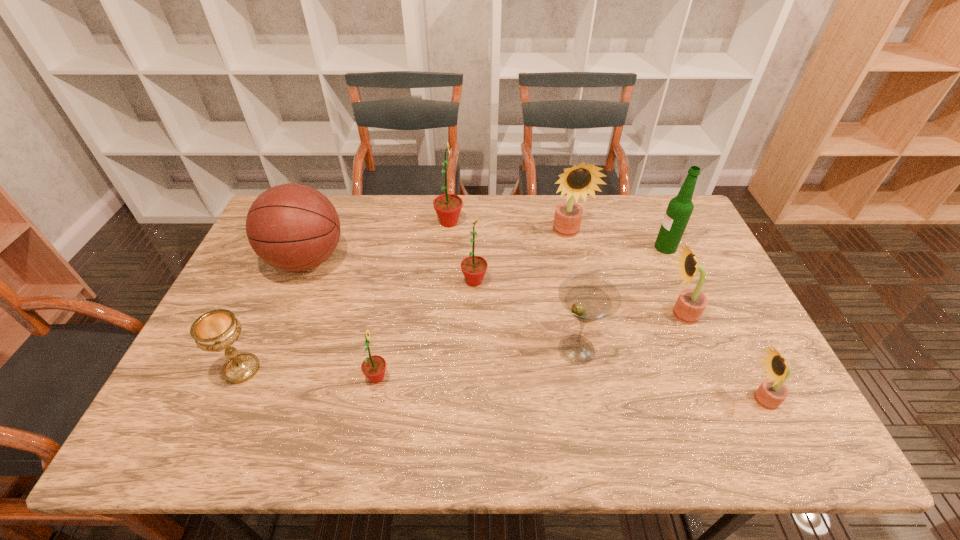
What are the coordinates of `martini` in the screenshot? It's located at (589, 298).

You are a GUI agent. You are given a task and a screenshot of the screen. Output one action in this format:
    pyautogui.click(x=<x>, y=<y>)
    Task: Click on the nearest yellow sunflower
    
    Given the screenshot: What is the action you would take?
    pyautogui.click(x=772, y=392)

Image resolution: width=960 pixels, height=540 pixels. Identify the location of the smallest yellow sunflower. (772, 392).

At what (x,y) coordinates should I click in order to perform the action: click on the leftmost green sunflower. Please return your answer as a coordinate pair (x, y). The image size is (960, 540). Looking at the image, I should click on (373, 367).

Where is `the nearest green sunflower`? This screenshot has height=540, width=960. the nearest green sunflower is located at coordinates (373, 367).

Where is `chalice`? The width and height of the screenshot is (960, 540). chalice is located at coordinates (218, 329).

Image resolution: width=960 pixels, height=540 pixels. In order to click on vacant space situated on the face of the fifth sunflower from right to left in this screenshot , I will do `click(569, 222)`.

Locate an element on the screen. This screenshot has width=960, height=540. free location located 0.080m on the face of the leftmost yellow sunflower is located at coordinates (573, 263).

Locate an element on the screen. free space located 0.200m on the label of the green beer bottle is located at coordinates (592, 247).

Locate an element on the screen. The height and width of the screenshot is (540, 960). free space located 0.150m on the label of the green beer bottle is located at coordinates (608, 247).